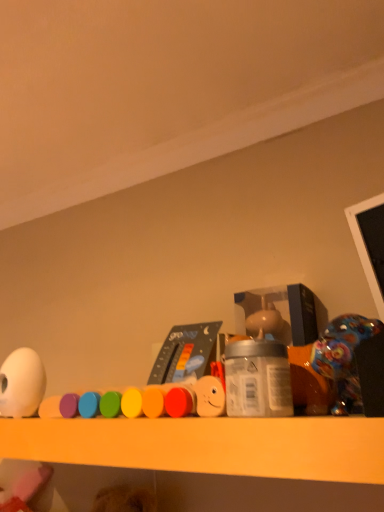
Question: From a real-world perspective, does smooth plastic toy at center, marked as the 2th toy in a right-to-left arrangement, sit lower than shiny plastic toy at right, arranged as the third toy when viewed from the left?

Choices:
 (A) yes
 (B) no

Answer: (A)

Question: Does smooth plastic toy at center, which is counted as the second toy, starting from the left, have a greater width compared to shiny plastic toy at right, arranged as the third toy when viewed from the left?

Choices:
 (A) yes
 (B) no

Answer: (B)

Question: Considering the relative positions of smooth plastic toy at center, which is counted as the second toy, starting from the left, and shiny plastic toy at right, placed as the 1th toy when sorted from right to left, in the image provided, is smooth plastic toy at center, which is counted as the second toy, starting from the left, to the left of shiny plastic toy at right, placed as the 1th toy when sorted from right to left, from the viewer's perspective?

Choices:
 (A) yes
 (B) no

Answer: (A)

Question: Is smooth plastic toy at center, marked as the 2th toy in a right-to-left arrangement, facing away from shiny plastic toy at right, arranged as the third toy when viewed from the left?

Choices:
 (A) no
 (B) yes

Answer: (A)

Question: Could you tell me if smooth plastic toy at center, marked as the 2th toy in a right-to-left arrangement, is facing shiny plastic toy at right, placed as the 1th toy when sorted from right to left?

Choices:
 (A) yes
 (B) no

Answer: (B)

Question: From a real-world perspective, is smooth plastic toy at center, marked as the 2th toy in a right-to-left arrangement, over shiny plastic toy at right, placed as the 1th toy when sorted from right to left?

Choices:
 (A) no
 (B) yes

Answer: (A)

Question: Is silver metallic jar at center further to the viewer compared to white matte egg at left, which is the first toy from left to right?

Choices:
 (A) no
 (B) yes

Answer: (A)

Question: Are silver metallic jar at center and white matte egg at left, arranged as the third toy when viewed from the right, far apart?

Choices:
 (A) no
 (B) yes

Answer: (A)

Question: Is white matte egg at left, arranged as the third toy when viewed from the right, located within silver metallic jar at center?

Choices:
 (A) yes
 (B) no

Answer: (B)

Question: Is silver metallic jar at center located outside white matte egg at left, which is the first toy from left to right?

Choices:
 (A) no
 (B) yes

Answer: (B)

Question: Is silver metallic jar at center wider than white matte egg at left, arranged as the third toy when viewed from the right?

Choices:
 (A) yes
 (B) no

Answer: (A)

Question: Are silver metallic jar at center and white matte egg at left, arranged as the third toy when viewed from the right, making contact?

Choices:
 (A) no
 (B) yes

Answer: (A)

Question: Can smooth plastic toy at center, which is counted as the second toy, starting from the left, be found inside white matte egg at left, which is the first toy from left to right?

Choices:
 (A) yes
 (B) no

Answer: (B)